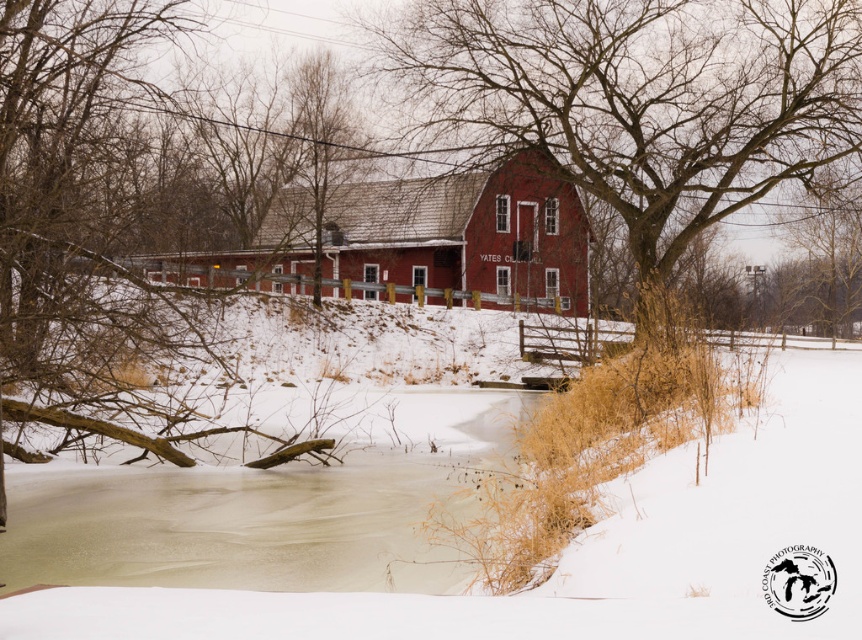
Question: Among these objects, which one is farthest from the camera?

Choices:
 (A) bare branches at left
 (B) matte red barn at center

Answer: (B)

Question: Based on their relative distances, which object is nearer to the matte red barn at center?

Choices:
 (A) bare branches at left
 (B) bare branches at center

Answer: (B)

Question: Can you confirm if bare branches at center is positioned to the right of matte red barn at center?

Choices:
 (A) yes
 (B) no

Answer: (A)

Question: Which point is closer to the camera?

Choices:
 (A) (811, 77)
 (B) (506, 173)

Answer: (A)

Question: Is bare branches at left closer to camera compared to matte red barn at center?

Choices:
 (A) no
 (B) yes

Answer: (B)

Question: Is bare branches at left closer to camera compared to matte red barn at center?

Choices:
 (A) yes
 (B) no

Answer: (A)